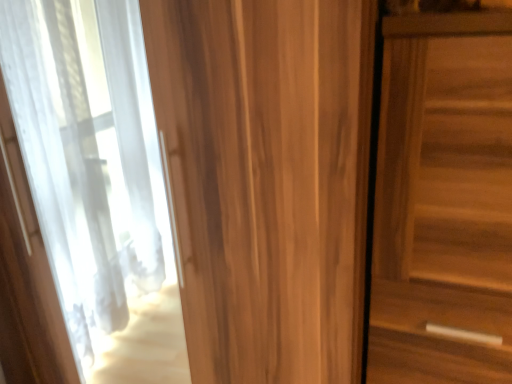
Question: Does wooden door at center, which is the first door from left to right, have a lesser height compared to wooden door at right, which is counted as the second door, starting from the left?

Choices:
 (A) yes
 (B) no

Answer: (B)

Question: Is wooden door at center, which is the 2th door in right-to-left order, bigger than wooden door at right, marked as the 1th door in a right-to-left arrangement?

Choices:
 (A) no
 (B) yes

Answer: (B)

Question: From the image's perspective, is wooden door at center, which is the first door from left to right, below wooden door at right, marked as the 1th door in a right-to-left arrangement?

Choices:
 (A) yes
 (B) no

Answer: (B)

Question: Is wooden door at center, which is the 2th door in right-to-left order, taller than wooden door at right, which is counted as the second door, starting from the left?

Choices:
 (A) no
 (B) yes

Answer: (B)

Question: Is wooden door at center, which is the first door from left to right, further to camera compared to wooden door at right, which is counted as the second door, starting from the left?

Choices:
 (A) no
 (B) yes

Answer: (A)

Question: Is wooden door at right, which is counted as the second door, starting from the left, located within wooden door at center, which is the 2th door in right-to-left order?

Choices:
 (A) yes
 (B) no

Answer: (B)

Question: Considering the relative sizes of wooden door at right, which is counted as the second door, starting from the left, and wooden door at center, which is the first door from left to right, in the image provided, is wooden door at right, which is counted as the second door, starting from the left, smaller than wooden door at center, which is the first door from left to right,?

Choices:
 (A) no
 (B) yes

Answer: (B)

Question: Can we say wooden door at right, marked as the 1th door in a right-to-left arrangement, lies outside wooden door at center, which is the first door from left to right?

Choices:
 (A) yes
 (B) no

Answer: (A)

Question: Is wooden door at right, marked as the 1th door in a right-to-left arrangement, shorter than wooden door at center, which is the first door from left to right?

Choices:
 (A) no
 (B) yes

Answer: (B)

Question: From a real-world perspective, is wooden door at right, marked as the 1th door in a right-to-left arrangement, physically below wooden door at center, which is the 2th door in right-to-left order?

Choices:
 (A) yes
 (B) no

Answer: (B)

Question: From the image's perspective, is wooden door at right, marked as the 1th door in a right-to-left arrangement, located beneath wooden door at center, which is the 2th door in right-to-left order?

Choices:
 (A) no
 (B) yes

Answer: (B)

Question: Considering the relative sizes of wooden door at right, which is counted as the second door, starting from the left, and wooden door at center, which is the first door from left to right, in the image provided, is wooden door at right, which is counted as the second door, starting from the left, bigger than wooden door at center, which is the first door from left to right,?

Choices:
 (A) yes
 (B) no

Answer: (B)

Question: Which is correct: wooden door at right, which is counted as the second door, starting from the left, is inside wooden door at center, which is the 2th door in right-to-left order, or outside of it?

Choices:
 (A) outside
 (B) inside

Answer: (A)